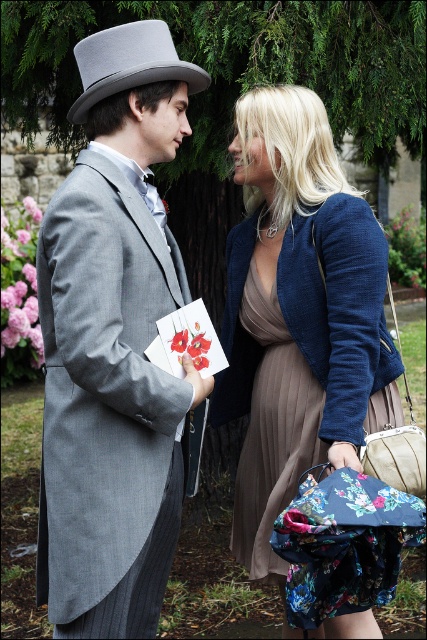
You are standing in a garden where two people are talking. The person on the left is wearing a gray top hat. There is a point marked at coordinates [114,346]. What object is located at this point?

The point at [114,346] indicates the gray wool top hat at upper left.

Looking at this image, you are a photographer trying to capture a closeup shot of both the gray wool top hat at upper left and the matte blue blazer at center. Your camera has a maximum focus range of 20 inches. Can you fit both objects into the frame without moving the camera?

The gray wool top hat at upper left and matte blue blazer at center are 23.08 inches apart, which exceeds the camera maximum focus range of 20 inches. Therefore, you cannot fit both objects into the frame without moving the camera.

You are a tailor measuring hats for a costume fitting. You have two hats available in the image, the gray wool top hat at upper left and the gray felt top hat at upper left. Which one is closer to the edge of the image?

The gray wool top hat at upper left is 21.72 inches from the gray felt top hat at upper left, so the one closer to the edge of the image cannot be determined without knowing their distances from the edge itself.